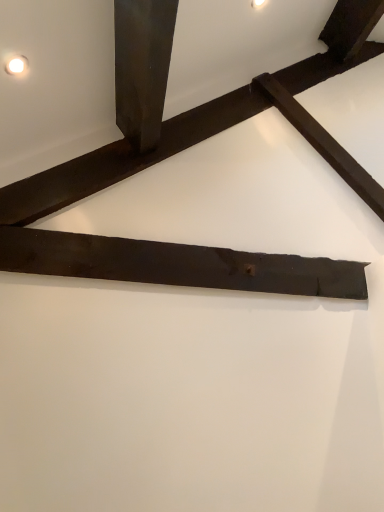
The height and width of the screenshot is (512, 384). Describe the element at coordinates (176, 264) in the screenshot. I see `rusty metal plank at center` at that location.

Locate an element on the screen. rusty metal plank at center is located at coordinates (176, 264).

Image resolution: width=384 pixels, height=512 pixels. I want to click on rusty metal plank at center, so click(176, 264).